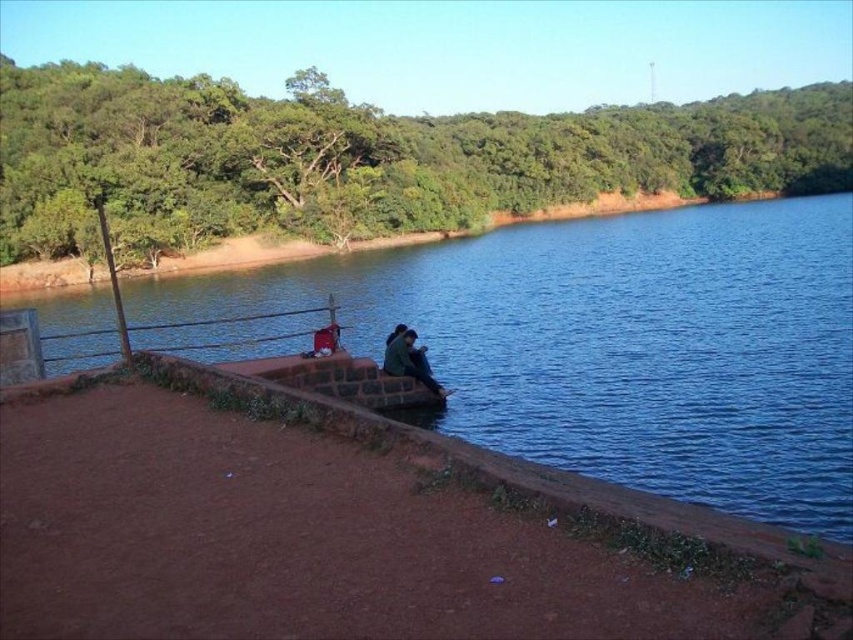
Question: Is blue water at center below dark green fabric jacket at center?

Choices:
 (A) yes
 (B) no

Answer: (B)

Question: Observing the image, what is the correct spatial positioning of blue water at center in reference to dark green fabric jacket at center?

Choices:
 (A) above
 (B) below

Answer: (A)

Question: Which object is farther from the camera taking this photo?

Choices:
 (A) dark green fabric jacket at center
 (B) blue water at center

Answer: (A)

Question: Is blue water at center thinner than dark green fabric jacket at center?

Choices:
 (A) no
 (B) yes

Answer: (A)

Question: Which object appears closest to the camera in this image?

Choices:
 (A) blue water at center
 (B) dark green fabric jacket at center

Answer: (A)